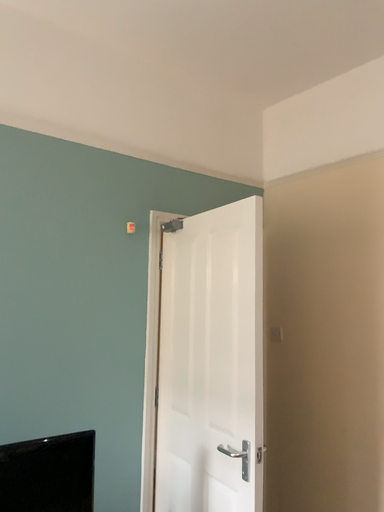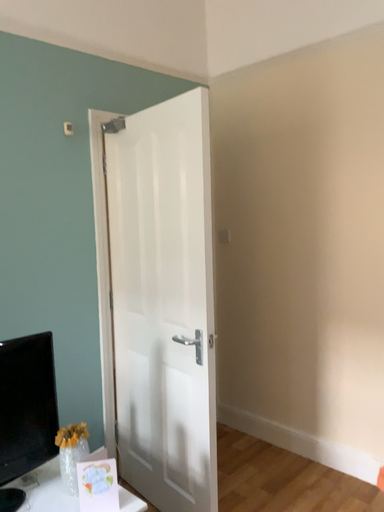
Question: Which way did the camera rotate in the video?

Choices:
 (A) rotated right
 (B) rotated left

Answer: (A)